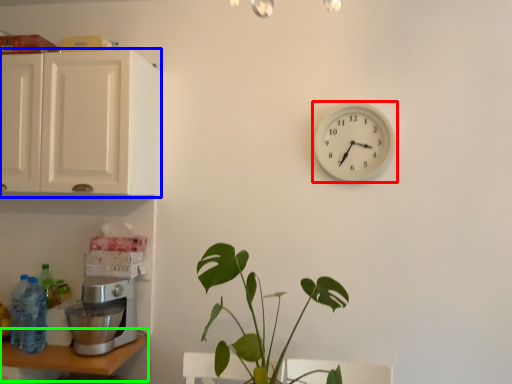
Question: Which is farther away from wall clock (highlighted by a red box)? cabinetry (highlighted by a blue box) or table (highlighted by a green box)?

Choices:
 (A) cabinetry
 (B) table

Answer: (B)